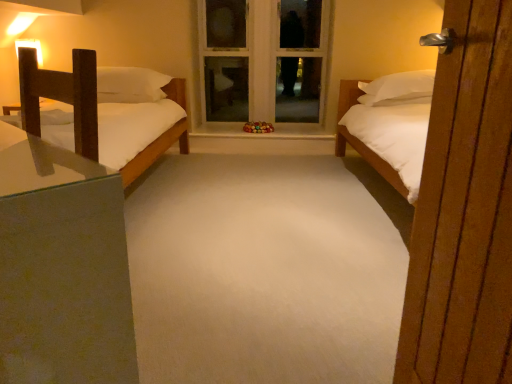
Question: Is wooden nightstand at left in contact with white soft carpet at center?

Choices:
 (A) yes
 (B) no

Answer: (B)

Question: Is wooden nightstand at left far away from white soft carpet at center?

Choices:
 (A) no
 (B) yes

Answer: (B)

Question: Considering the relative sizes of wooden nightstand at left and white soft carpet at center in the image provided, is wooden nightstand at left shorter than white soft carpet at center?

Choices:
 (A) no
 (B) yes

Answer: (A)

Question: Is wooden nightstand at left not within white soft carpet at center?

Choices:
 (A) no
 (B) yes

Answer: (B)

Question: Is the position of wooden nightstand at left more distant than that of white soft carpet at center?

Choices:
 (A) yes
 (B) no

Answer: (B)

Question: Could you tell me if wooden nightstand at left is turned towards white soft carpet at center?

Choices:
 (A) yes
 (B) no

Answer: (B)

Question: Can you confirm if white soft carpet at center is thinner than white painted wood window frame at center?

Choices:
 (A) yes
 (B) no

Answer: (B)

Question: From a real-world perspective, does white soft carpet at center sit lower than white painted wood window frame at center?

Choices:
 (A) no
 (B) yes

Answer: (B)

Question: From the image's perspective, is white soft carpet at center on white painted wood window frame at center?

Choices:
 (A) yes
 (B) no

Answer: (B)

Question: Does white soft carpet at center appear on the right side of white painted wood window frame at center?

Choices:
 (A) no
 (B) yes

Answer: (A)

Question: Considering the relative sizes of white soft carpet at center and white painted wood window frame at center in the image provided, is white soft carpet at center wider than white painted wood window frame at center?

Choices:
 (A) no
 (B) yes

Answer: (B)

Question: Is white soft carpet at center surrounding white painted wood window frame at center?

Choices:
 (A) no
 (B) yes

Answer: (A)

Question: Can you confirm if wooden nightstand at left is positioned to the left of white painted wood window frame at center?

Choices:
 (A) yes
 (B) no

Answer: (A)